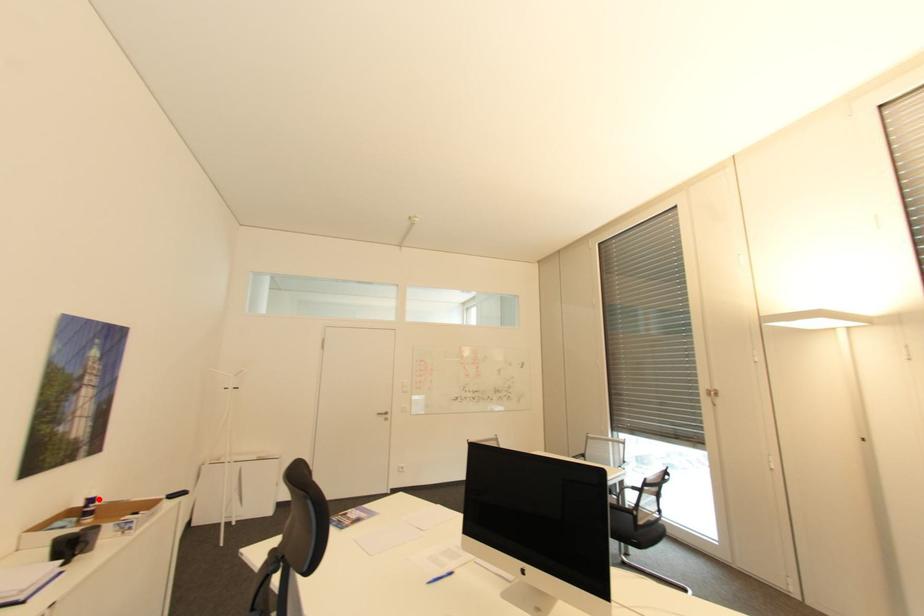
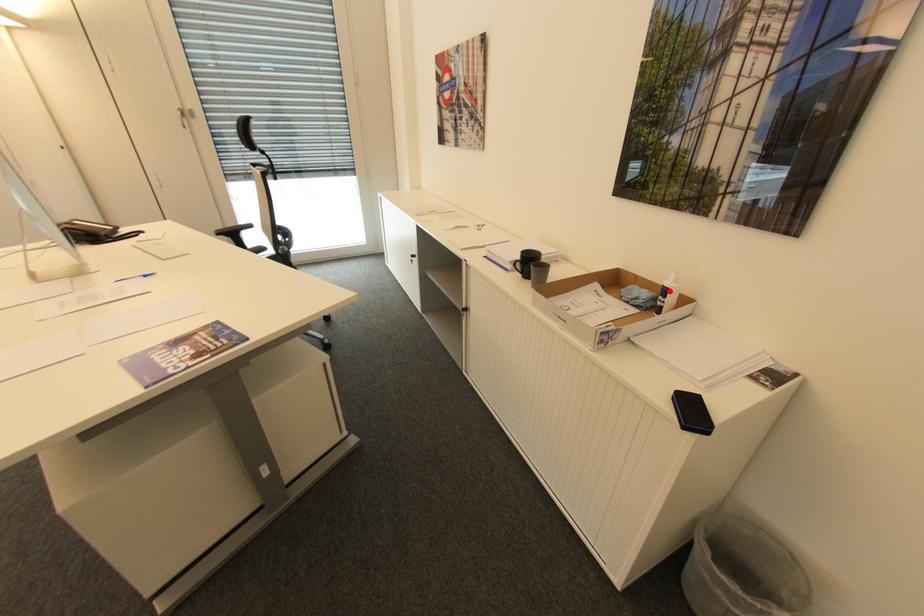
I am providing you with two images of the same scene from different viewpoints. A red point is marked on the first image and another point is marked on the second image. Are the points marked in image1 and image2 representing the same 3D position?

Yes